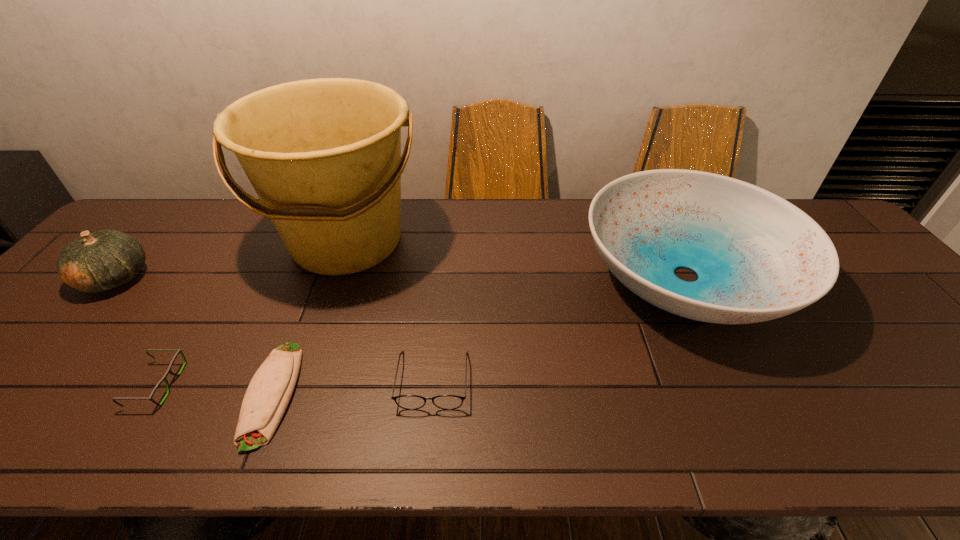
In order to click on free space between the burrito and the gourd in this screenshot , I will do `click(194, 336)`.

Find the location of a particular element. vacant space that is in between the taller spectacles and the dish is located at coordinates (560, 328).

Identify the location of vacant area that lies between the burrito and the bucket. [310, 318].

At what (x,y) coordinates should I click in order to perform the action: click on free space between the burrito and the gourd. Please return your answer as a coordinate pair (x, y). Looking at the image, I should click on (194, 336).

Image resolution: width=960 pixels, height=540 pixels. Find the location of `vacant area between the bucket and the shorter spectacles`. vacant area between the bucket and the shorter spectacles is located at coordinates 252,313.

Identify the location of free spot between the dish and the right spectacles. This screenshot has width=960, height=540. (560, 328).

Find the location of a particular element. The height and width of the screenshot is (540, 960). free space between the burrito and the shorter spectacles is located at coordinates (214, 389).

Image resolution: width=960 pixels, height=540 pixels. I want to click on vacant region between the fourth tallest object and the leftmost object, so click(x=275, y=329).

Find the location of a particular element. This screenshot has width=960, height=540. object that is the fifth nearest to the bucket is located at coordinates (758, 257).

This screenshot has width=960, height=540. Identify the location of object that is the nearest to the tallest object. (268, 394).